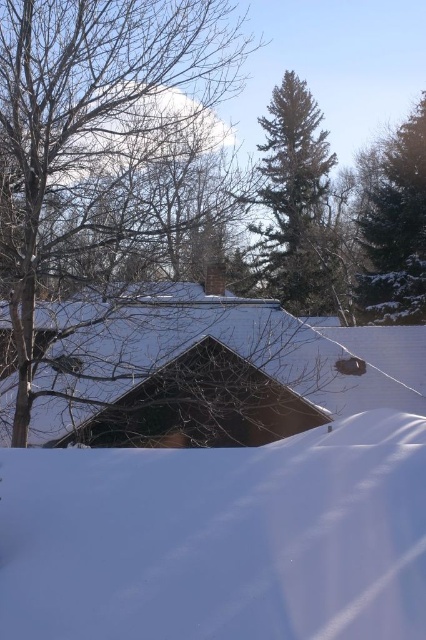
Question: Which object appears farthest from the camera in this image?

Choices:
 (A) white fluffy snow at lower center
 (B) green needle-like tree at upper center
 (C) bare branches at left

Answer: (B)

Question: Can you confirm if white fluffy snow at lower center is bigger than bare branches at left?

Choices:
 (A) yes
 (B) no

Answer: (B)

Question: Is bare branches at left further to camera compared to green textured evergreen tree at upper right?

Choices:
 (A) no
 (B) yes

Answer: (A)

Question: Is white fluffy snow at lower center smaller than green textured evergreen tree at upper right?

Choices:
 (A) yes
 (B) no

Answer: (A)

Question: Which point is farther from the camera taking this photo?

Choices:
 (A) (103, 557)
 (B) (20, 241)
 (C) (406, 173)
 (D) (294, 250)

Answer: (D)

Question: Which is nearer to the green textured evergreen tree at upper right?

Choices:
 (A) green needle-like tree at upper center
 (B) bare branches at left
 (C) white fluffy snow at lower center

Answer: (A)